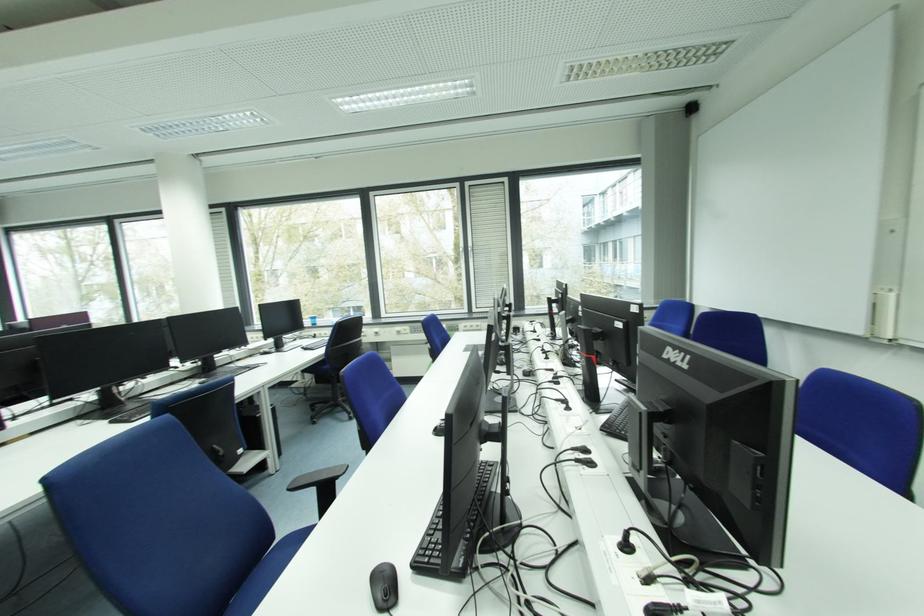
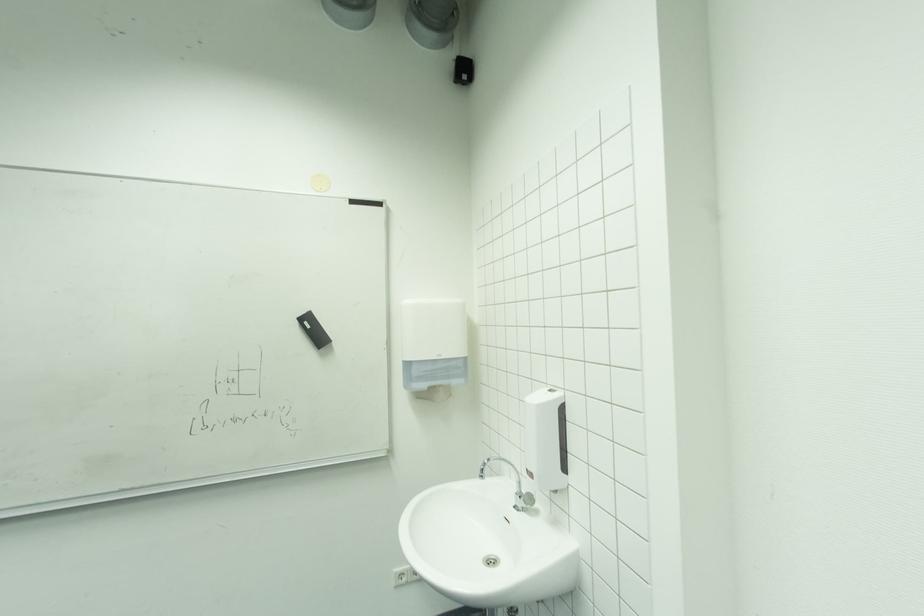
Question: How did the camera likely rotate?

Choices:
 (A) Left
 (B) Right
 (C) Up
 (D) Down

Answer: (B)